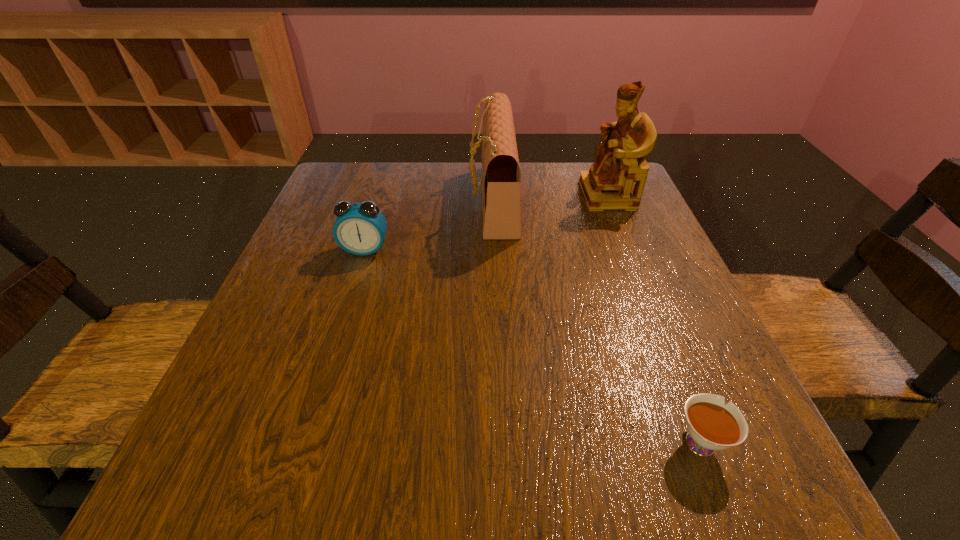
Point out which object is positioned as the third nearest to the shortest object. Please provide its 2D coordinates. Your answer should be formatted as a tuple, i.e. [(x, y)], where the tuple contains the x and y coordinates of a point satisfying the conditions above.

[(360, 228)]

Choose which object is the nearest neighbor to the nearest object. Please provide its 2D coordinates. Your answer should be formatted as a tuple, i.e. [(x, y)], where the tuple contains the x and y coordinates of a point satisfying the conditions above.

[(501, 178)]

This screenshot has height=540, width=960. In order to click on vacant space that satisfies the following two spatial constraints: 1. on the front-facing side of the figurine; 2. on the face of the leftmost object in this screenshot , I will do `click(630, 249)`.

Locate an element on the screen. Image resolution: width=960 pixels, height=540 pixels. vacant region that satisfies the following two spatial constraints: 1. on the front-facing side of the tallest object; 2. on the face of the second shortest object is located at coordinates (630, 249).

The image size is (960, 540). Identify the location of vacant point that satisfies the following two spatial constraints: 1. on the front-facing side of the figurine; 2. on the face of the leftmost object. (630, 249).

At what (x,y) coordinates should I click in order to perform the action: click on vacant space that satisfies the following two spatial constraints: 1. on the front-facing side of the second object from left to right; 2. on the face of the alarm clock. Please return your answer as a coordinate pair (x, y). Image resolution: width=960 pixels, height=540 pixels. Looking at the image, I should click on (495, 249).

This screenshot has height=540, width=960. I want to click on free spot that satisfies the following two spatial constraints: 1. on the front-facing side of the handbag; 2. on the face of the leftmost object, so click(495, 249).

Where is `vacant space that satisfies the following two spatial constraints: 1. on the front-facing side of the third shortest object; 2. on the face of the second nearest object`? vacant space that satisfies the following two spatial constraints: 1. on the front-facing side of the third shortest object; 2. on the face of the second nearest object is located at coordinates (495, 249).

You are a GUI agent. You are given a task and a screenshot of the screen. Output one action in this format:
    pyautogui.click(x=<x>, y=<y>)
    Task: Click on the vacant space that satisfies the following two spatial constraints: 1. on the front-facing side of the tallest object; 2. on the face of the alarm clock
    
    Given the screenshot: What is the action you would take?
    pyautogui.click(x=630, y=249)

What are the coordinates of `vacant space that satisfies the following two spatial constraints: 1. on the front-facing side of the tallest object; 2. on the face of the third farthest object` in the screenshot? It's located at (630, 249).